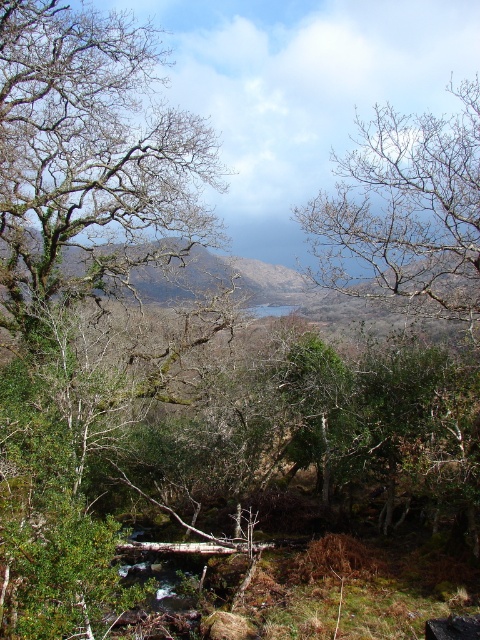
How much distance is there between green mossy tree at left and bare branches at upper center?

green mossy tree at left and bare branches at upper center are 38.07 feet apart from each other.

Who is higher up, green mossy tree at left or bare branches at upper center?

Positioned higher is green mossy tree at left.

What do you see at coordinates (90, 154) in the screenshot?
I see `green mossy tree at left` at bounding box center [90, 154].

Locate an element on the screen. green mossy tree at left is located at coordinates (90, 154).

Who is shorter, bare branches at upper center or green mossy hillside at center?

Standing shorter between the two is bare branches at upper center.

Between point (453, 132) and point (78, 260), which one is positioned behind?

The point (78, 260) is more distant.

This screenshot has width=480, height=640. Identify the location of bare branches at upper center. (406, 211).

Is point (145, 189) farther from camera compared to point (23, 248)?

No, it is in front of (23, 248).

Between point (104, 60) and point (242, 291), which one is positioned behind?

The point (242, 291) is behind.

Who is more distant from viewer, (x=23, y=74) or (x=275, y=296)?

Positioned behind is point (x=275, y=296).

Identify the location of green mossy tree at left. The image size is (480, 640). (90, 154).